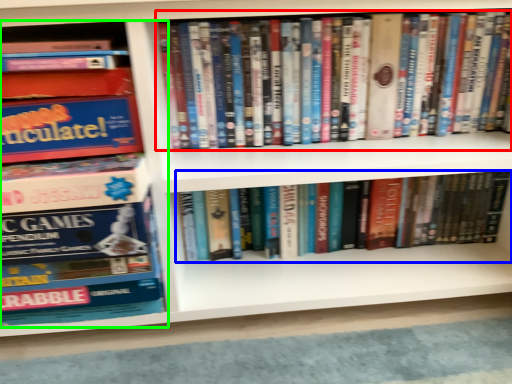
Question: Considering the real-world distances, which object is farthest from book (highlighted by a red box)? book (highlighted by a blue box) or book (highlighted by a green box)?

Choices:
 (A) book
 (B) book

Answer: (B)